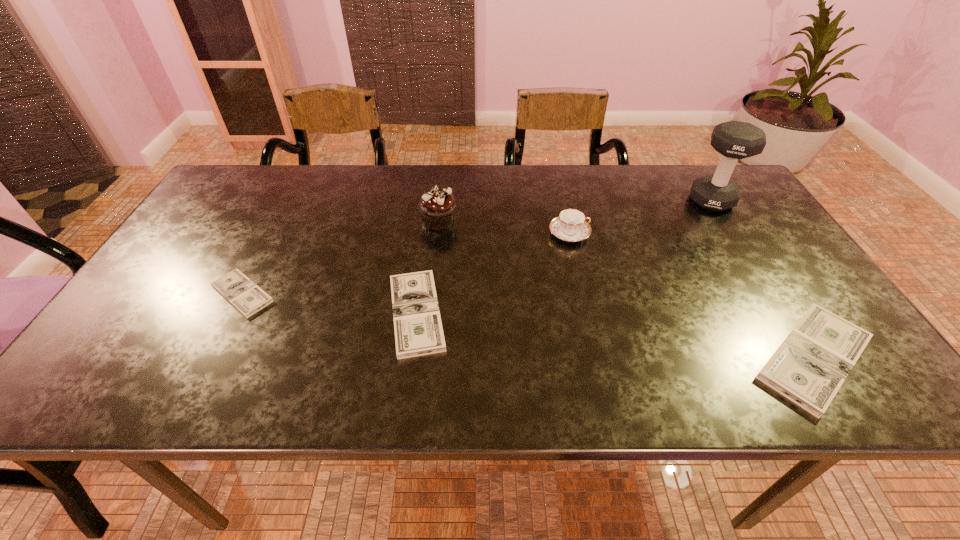
In order to click on vacant space located on the right of the second shortest object in this screenshot , I will do `click(599, 313)`.

The height and width of the screenshot is (540, 960). I want to click on free location located 0.300m on the left of the rightmost dollar, so click(600, 358).

What are the coordinates of `blank space located 0.190m on the front of the tallest object` in the screenshot? It's located at (749, 259).

The height and width of the screenshot is (540, 960). Find the location of `free spot located on the left of the cupcake`. free spot located on the left of the cupcake is located at coordinates (301, 221).

Find the location of `free location located on the side with the handle of the fourth object from left to right`. free location located on the side with the handle of the fourth object from left to right is located at coordinates tap(667, 234).

Locate an element on the screen. object present at the far edge is located at coordinates [735, 140].

Image resolution: width=960 pixels, height=540 pixels. In order to click on object at the left edge in this screenshot , I will do `click(242, 293)`.

Locate an element on the screen. The width and height of the screenshot is (960, 540). dollar that is positioned at the right edge is located at coordinates (809, 367).

You are a GUI agent. You are given a task and a screenshot of the screen. Output one action in this format:
    pyautogui.click(x=<x>, y=<y>)
    Task: Click on the dumbbell present at the right edge
    The height and width of the screenshot is (540, 960).
    Given the screenshot: What is the action you would take?
    pyautogui.click(x=735, y=140)

You are a GUI agent. You are given a task and a screenshot of the screen. Output one action in this format:
    pyautogui.click(x=<x>, y=<y>)
    Task: Click on the object located in the far right corner section of the desktop
    
    Given the screenshot: What is the action you would take?
    pyautogui.click(x=735, y=140)